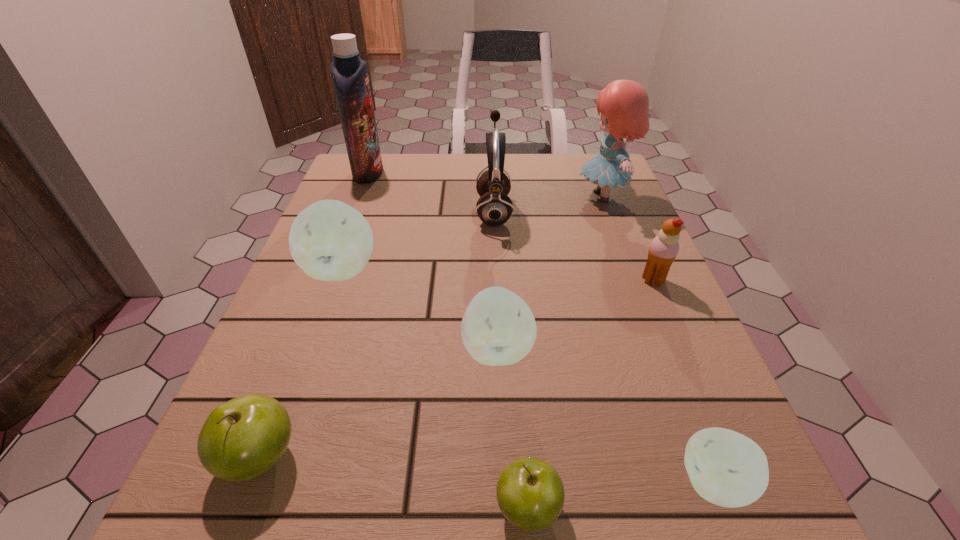
The width and height of the screenshot is (960, 540). Identify the location of the second farthest apple. (498, 328).

The width and height of the screenshot is (960, 540). In order to click on the bigger green apple in this screenshot , I will do `click(241, 439)`.

This screenshot has height=540, width=960. What are the coordinates of `the rightmost apple` in the screenshot? It's located at (726, 468).

The width and height of the screenshot is (960, 540). I want to click on the rightmost white apple, so click(x=726, y=468).

You are a GUI agent. You are given a task and a screenshot of the screen. Output one action in this format:
    pyautogui.click(x=<x>, y=<y>)
    Task: Click on the vacant space located on the front label of the tallest object
    
    Given the screenshot: What is the action you would take?
    pyautogui.click(x=495, y=172)

The width and height of the screenshot is (960, 540). I want to click on free region located 0.160m on the front-facing side of the second tallest object, so click(512, 195).

The height and width of the screenshot is (540, 960). In order to click on free location located 0.150m on the front-facing side of the second tallest object in this screenshot , I will do `click(516, 195)`.

This screenshot has height=540, width=960. I want to click on vacant space located 0.190m on the front-facing side of the second tallest object, so click(499, 195).

Image resolution: width=960 pixels, height=540 pixels. Find the location of `vacant area situated on the ear pads of the brown earphone`. vacant area situated on the ear pads of the brown earphone is located at coordinates (455, 211).

What are the coordinates of `vacant space located on the ear pads of the brown earphone` in the screenshot? It's located at (450, 211).